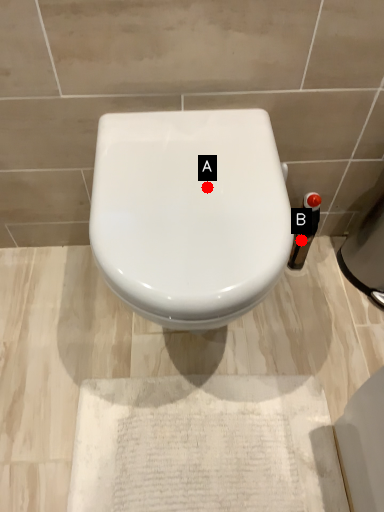
Question: Two points are circled on the image, labeled by A and B beside each circle. Which of the following is the closest to the observer?

Choices:
 (A) A is closer
 (B) B is closer

Answer: (A)